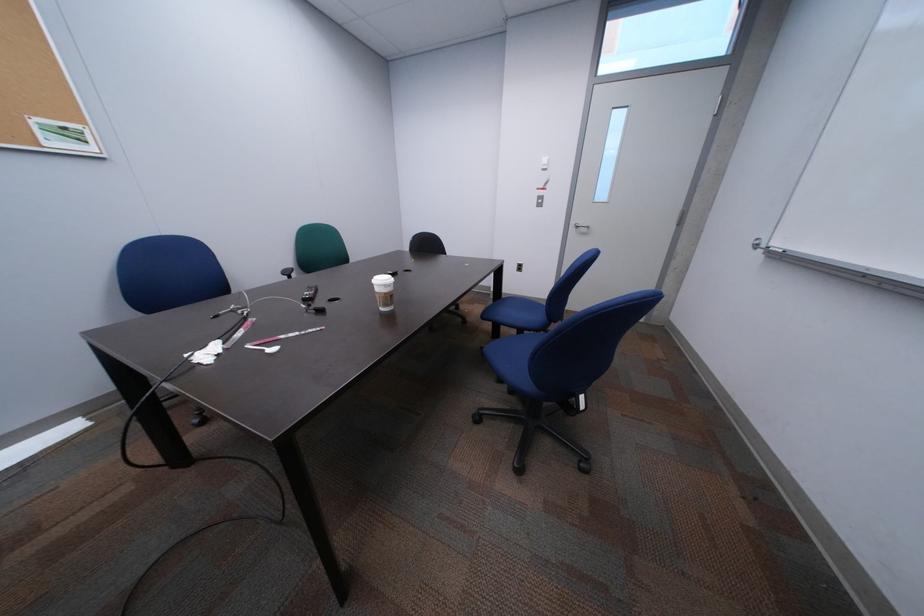
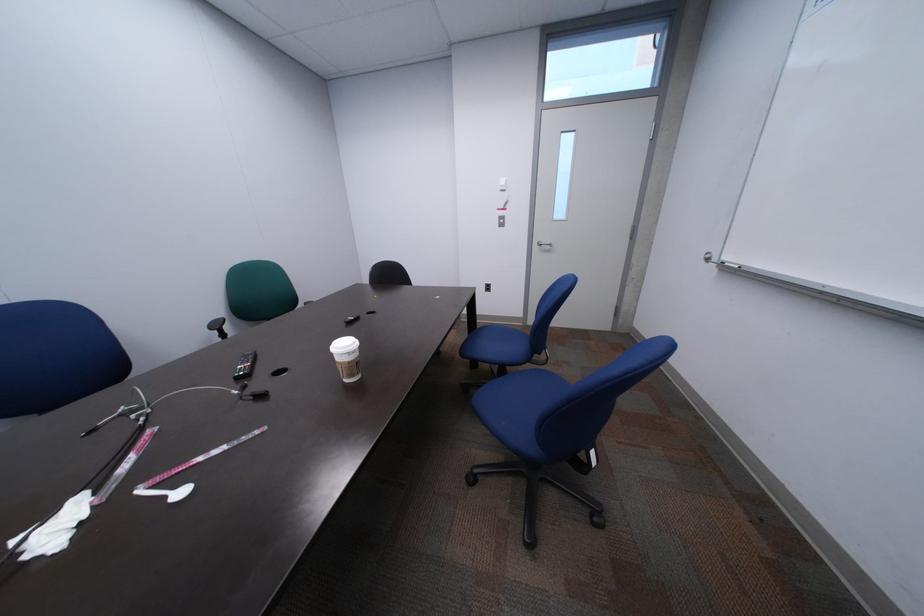
Question: What movement of the cameraman would produce the second image?

Choices:
 (A) Left
 (B) Right
 (C) Forward
 (D) Backward

Answer: (C)